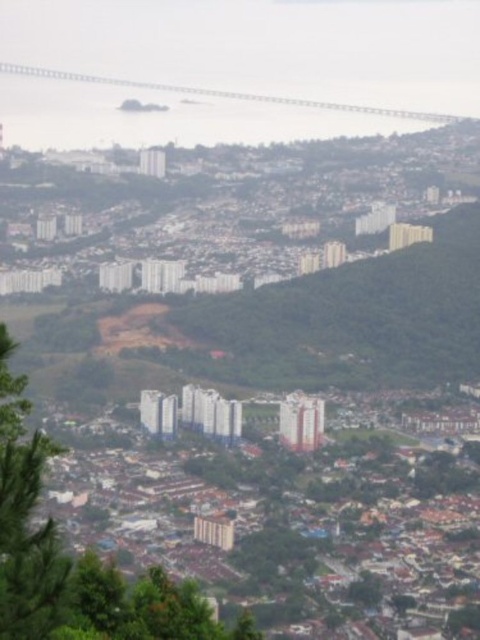
Is green leafy tree at lower left behind metallic gray bridge at upper left?

No, it is in front of metallic gray bridge at upper left.

Find the location of a particular element. green leafy tree at lower left is located at coordinates click(x=24, y=518).

Identify the location of green leafy tree at lower left. (24, 518).